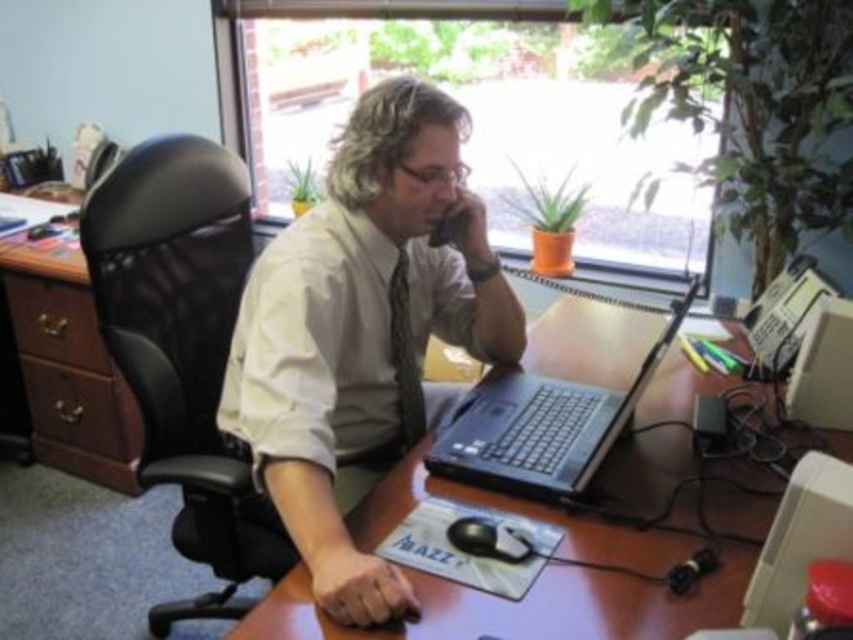
Can you confirm if brown wooden table at center is thinner than white smooth dress shirt at center?

In fact, brown wooden table at center might be wider than white smooth dress shirt at center.

Which is more to the left, brown wooden table at center or white smooth dress shirt at center?

white smooth dress shirt at center is more to the left.

At what (x,y) coordinates should I click in order to perform the action: click on brown wooden table at center. Please return your answer as a coordinate pair (x, y). This screenshot has width=853, height=640. Looking at the image, I should click on (521, 608).

Locate an element on the screen. This screenshot has height=640, width=853. brown wooden table at center is located at coordinates (521, 608).

Who is more distant from viewer, (152, 262) or (395, 307)?

The point (152, 262) is more distant.

Which of these two, black mesh swivel chair at left or textured gray tie at center, stands shorter?

With less height is textured gray tie at center.

The image size is (853, 640). What do you see at coordinates (183, 348) in the screenshot? I see `black mesh swivel chair at left` at bounding box center [183, 348].

This screenshot has height=640, width=853. What are the coordinates of `black mesh swivel chair at left` in the screenshot? It's located at (183, 348).

Is brown wooden table at center closer to the viewer compared to black plastic laptop at center?

Yes, it is.

What do you see at coordinates (521, 608) in the screenshot? This screenshot has height=640, width=853. I see `brown wooden table at center` at bounding box center [521, 608].

Find the location of `brown wooden table at center`. brown wooden table at center is located at coordinates (521, 608).